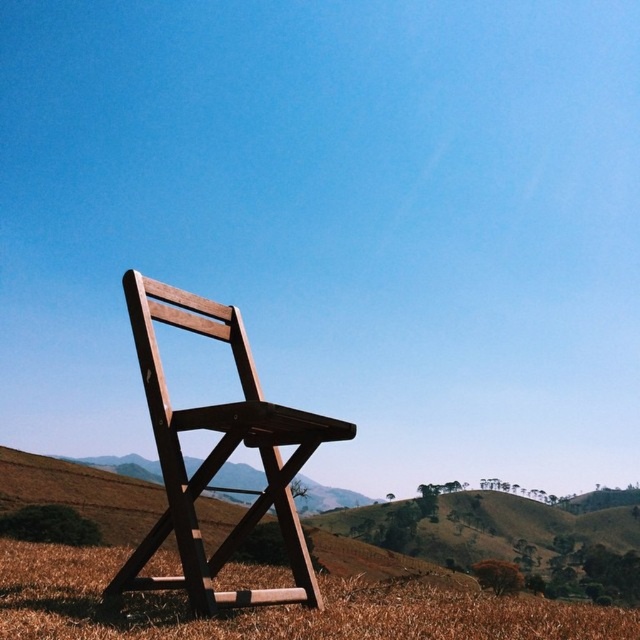
Question: Is brown grass at lower center bigger than wooden folding chair at center?

Choices:
 (A) yes
 (B) no

Answer: (A)

Question: Which point is closer to the camera taking this photo?

Choices:
 (A) pos(285,540)
 (B) pos(64,556)

Answer: (A)

Question: From the image, what is the correct spatial relationship of brown grass at lower center in relation to wooden folding chair at center?

Choices:
 (A) left
 (B) right

Answer: (B)

Question: Which of the following is the closest to the observer?

Choices:
 (A) wooden folding chair at center
 (B) brown grass at lower center

Answer: (B)

Question: Does brown grass at lower center appear over wooden folding chair at center?

Choices:
 (A) no
 (B) yes

Answer: (A)

Question: Among these points, which one is nearest to the camera?

Choices:
 (A) (234, 541)
 (B) (518, 621)

Answer: (B)